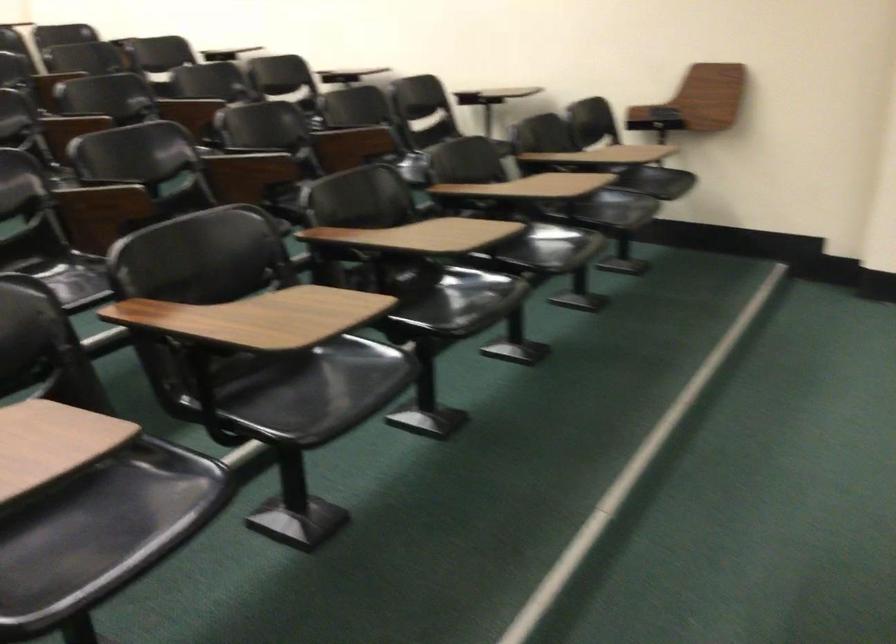
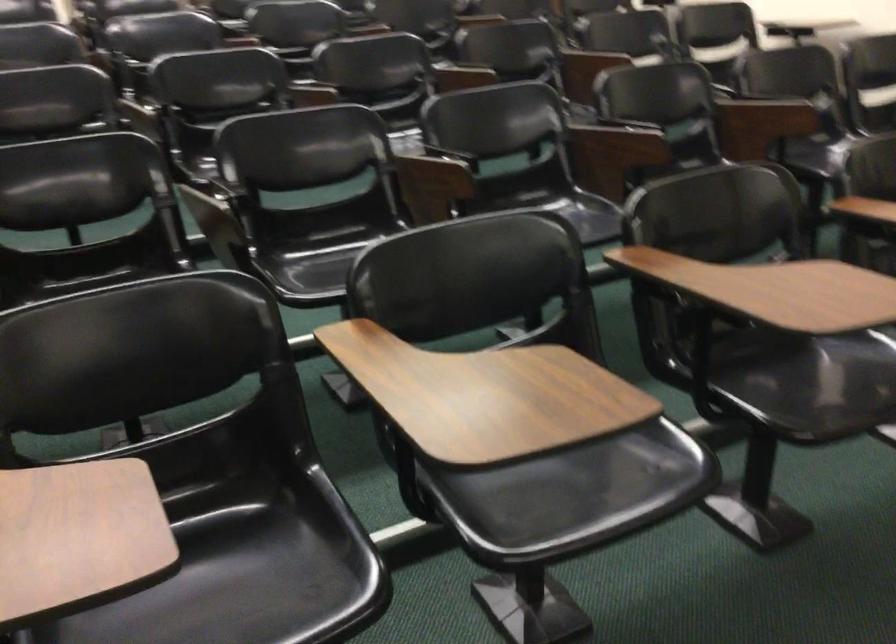
Find the pixel in the second image that matches point 261,166 in the first image.

(615, 140)